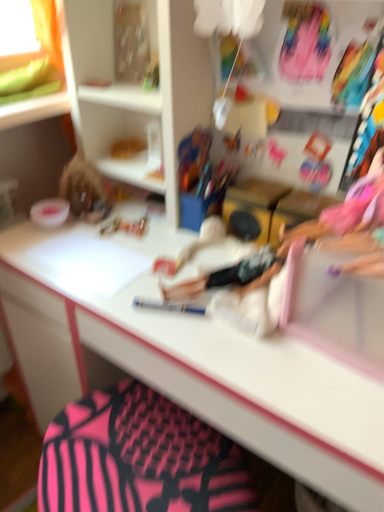
You are a GUI agent. You are given a task and a screenshot of the screen. Output one action in this format:
    pyautogui.click(x=<x>, y=<y>)
    Task: Click on the pink fabric swivel chair at lower center
    The image size is (384, 512).
    Given the screenshot: What is the action you would take?
    pyautogui.click(x=139, y=458)

Image resolution: width=384 pixels, height=512 pixels. What do you see at coordinates (139, 458) in the screenshot? I see `pink fabric swivel chair at lower center` at bounding box center [139, 458].

You are a GUI agent. You are given a task and a screenshot of the screen. Output one action in this format:
    pyautogui.click(x=<x>, y=<y>)
    Task: Click on the white glossy desk at center
    
    Given the screenshot: What is the action you would take?
    pyautogui.click(x=188, y=359)

Describe the element at coordinates (188, 359) in the screenshot. The height and width of the screenshot is (512, 384). I see `white glossy desk at center` at that location.

Locate an element on the screen. The width and height of the screenshot is (384, 512). pink fabric swivel chair at lower center is located at coordinates (139, 458).

Can you confirm if white glossy desk at center is positioned to the left of pink fabric swivel chair at lower center?

No, white glossy desk at center is not to the left of pink fabric swivel chair at lower center.

Which object is further away from the camera taking this photo, white glossy desk at center or pink fabric swivel chair at lower center?

pink fabric swivel chair at lower center is behind.

Which is farther from the camera, (157, 284) or (128, 472)?

The point (157, 284) is behind.

From the image's perspective, between white glossy desk at center and pink fabric swivel chair at lower center, which one is located above?

white glossy desk at center is shown above in the image.

From a real-world perspective, is white glossy desk at center on top of pink fabric swivel chair at lower center?

Yes, from a real-world perspective, white glossy desk at center is over pink fabric swivel chair at lower center

Considering the sizes of objects white glossy desk at center and pink fabric swivel chair at lower center in the image provided, who is wider, white glossy desk at center or pink fabric swivel chair at lower center?

With larger width is white glossy desk at center.

Is white glossy desk at center shorter than pink fabric swivel chair at lower center?

In fact, white glossy desk at center may be taller than pink fabric swivel chair at lower center.

Which of these two, white glossy desk at center or pink fabric swivel chair at lower center, is bigger?

white glossy desk at center is bigger.

Would you say white glossy desk at center contains pink fabric swivel chair at lower center?

Yes, white glossy desk at center contains pink fabric swivel chair at lower center.

Looking at this image, is white glossy desk at center directly adjacent to pink fabric swivel chair at lower center?

No, white glossy desk at center is not with pink fabric swivel chair at lower center.

Is white glossy desk at center turned away from pink fabric swivel chair at lower center?

No, pink fabric swivel chair at lower center is not at the back of white glossy desk at center.

How many degrees apart are the facing directions of white glossy desk at center and pink fabric swivel chair at lower center?

They differ by 53.9 degrees in their facing directions.

How distant is white glossy desk at center from pink fabric swivel chair at lower center?

A distance of 7.64 inches exists between white glossy desk at center and pink fabric swivel chair at lower center.

The image size is (384, 512). I want to click on desk above the pink fabric swivel chair at lower center (from the image's perspective), so click(188, 359).

Is pink fabric swivel chair at lower center at the right side of white glossy desk at center?

In fact, pink fabric swivel chair at lower center is to the left of white glossy desk at center.

Considering the positions of objects pink fabric swivel chair at lower center and white glossy desk at center in the image provided, who is behind, pink fabric swivel chair at lower center or white glossy desk at center?

pink fabric swivel chair at lower center is further away from the camera.

Which is nearer, [147,484] or [156,331]?

Positioned in front is point [156,331].

From the image's perspective, is pink fabric swivel chair at lower center positioned above or below white glossy desk at center?

pink fabric swivel chair at lower center is situated lower than white glossy desk at center in the image.

In the scene shown: From a real-world perspective, is pink fabric swivel chair at lower center beneath white glossy desk at center?

Correct, in the physical world, pink fabric swivel chair at lower center is lower than white glossy desk at center.

Between pink fabric swivel chair at lower center and white glossy desk at center, which one has smaller width?

Thinner between the two is pink fabric swivel chair at lower center.

Can you confirm if pink fabric swivel chair at lower center is shorter than white glossy desk at center?

Indeed, pink fabric swivel chair at lower center has a lesser height compared to white glossy desk at center.

Looking at the image, does pink fabric swivel chair at lower center seem bigger or smaller compared to white glossy desk at center?

pink fabric swivel chair at lower center is smaller than white glossy desk at center.

Is pink fabric swivel chair at lower center outside of white glossy desk at center?

No, pink fabric swivel chair at lower center is not outside of white glossy desk at center.

Would you consider pink fabric swivel chair at lower center to be distant from white glossy desk at center?

pink fabric swivel chair at lower center is near white glossy desk at center, not far away.

Looking at this image, could you tell me if pink fabric swivel chair at lower center is facing white glossy desk at center?

No, pink fabric swivel chair at lower center does not turn towards white glossy desk at center.

Image resolution: width=384 pixels, height=512 pixels. Find the location of `swivel chair lying on the left of white glossy desk at center`. swivel chair lying on the left of white glossy desk at center is located at coordinates (139, 458).

In order to click on swivel chair below the white glossy desk at center (from a real-world perspective) in this screenshot , I will do `click(139, 458)`.

Find the location of a particular element. Image resolution: width=384 pixels, height=512 pixels. desk above the pink fabric swivel chair at lower center (from the image's perspective) is located at coordinates (188, 359).